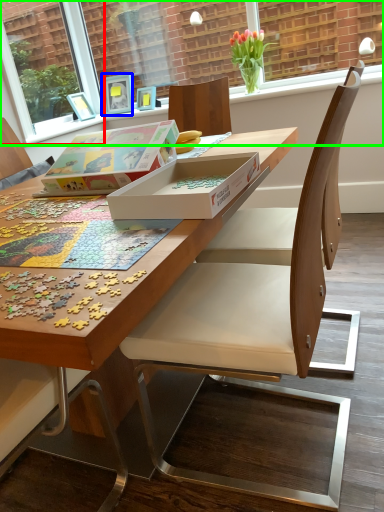
Question: Which object is the farthest from window screen (highlighted by a red box)? Choose among these: picture frame (highlighted by a blue box) or window screen (highlighted by a green box).

Choices:
 (A) picture frame
 (B) window screen

Answer: (B)